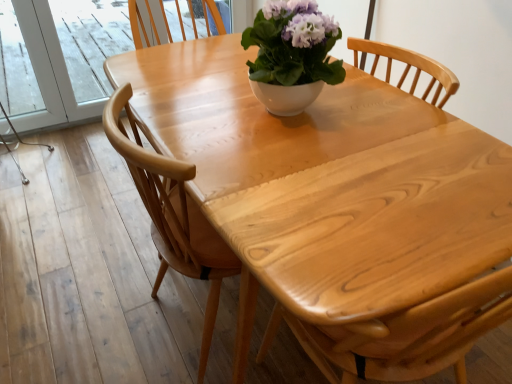
Where is `free region under light wood chair at center (from a real-world perspective)`? The image size is (512, 384). free region under light wood chair at center (from a real-world perspective) is located at coordinates (202, 323).